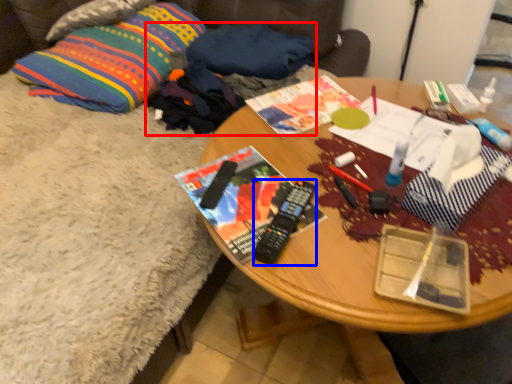
Question: Which point is closer to the camera, clothing (highlighted by a red box) or remote control (highlighted by a blue box)?

Choices:
 (A) clothing
 (B) remote control

Answer: (B)